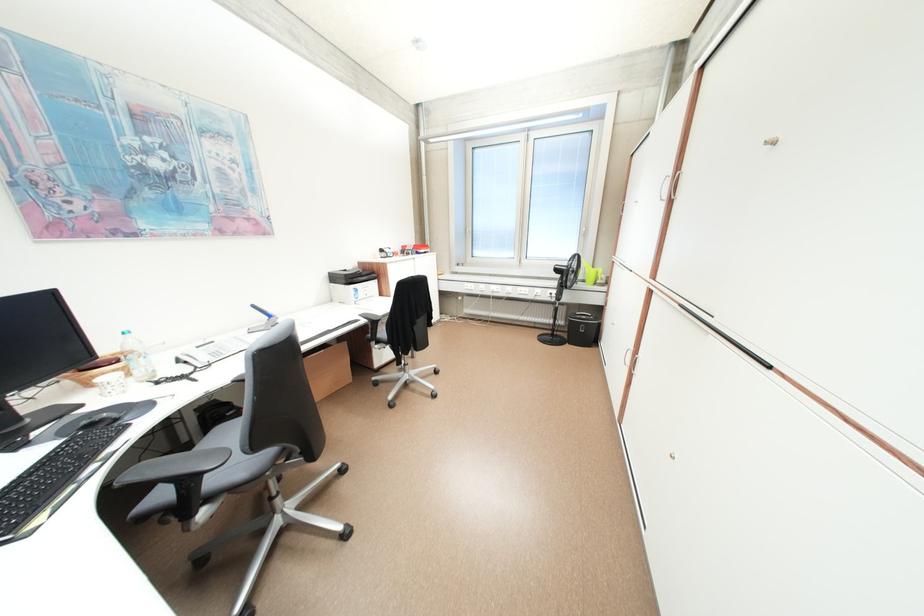
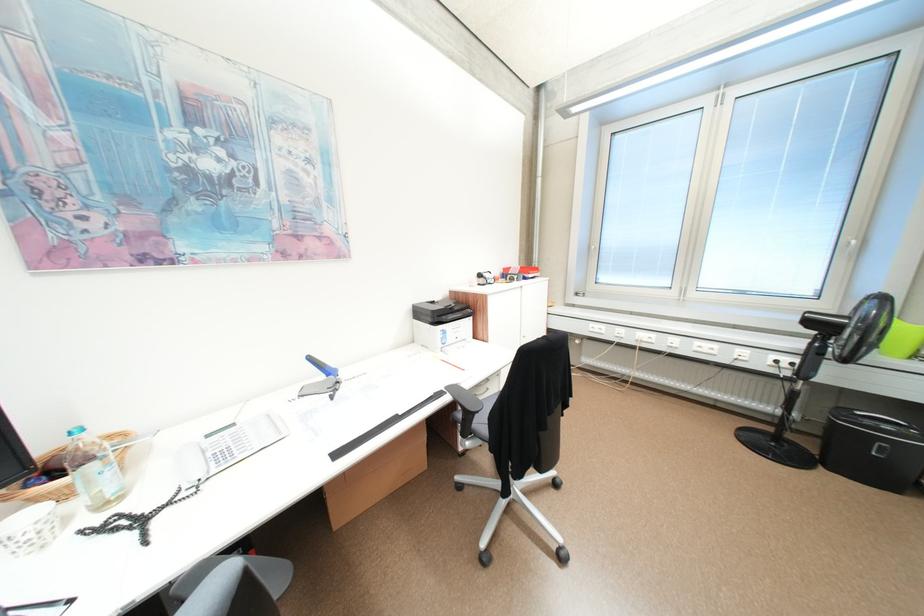
The point at (388, 321) is marked in the first image. Where is the corresponding point in the second image?

(487, 411)